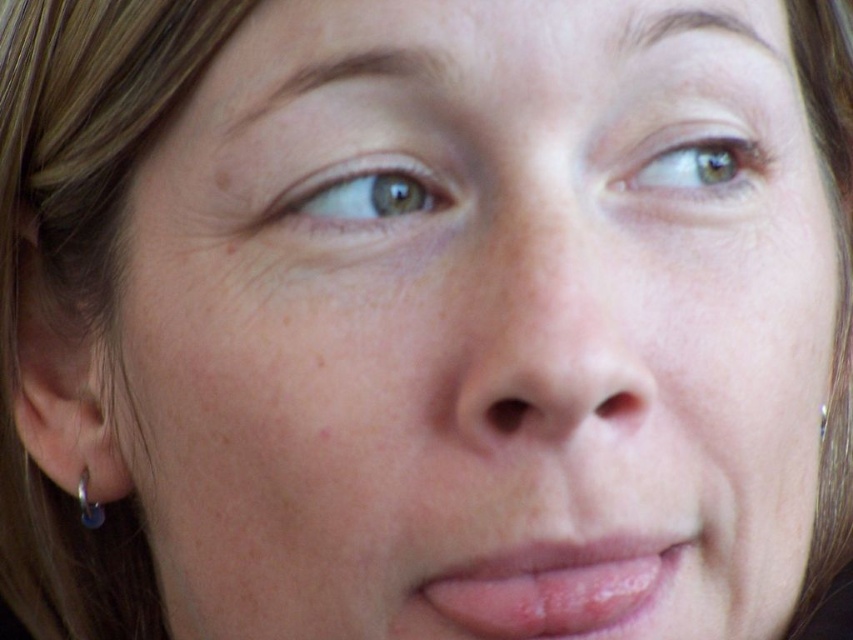
You are an artist sketching the person in the image. You want to draw the point at coordinate (554, 586). Where should you place it in relation to the pink glossy lips at center?

The point at (554, 586) is on the pink glossy lips at center, so you should place it directly on the pink glossy lips at center.

You are a photographer adjusting the focus on your camera. You want to ensure both the smooth skin nose at center and the silver metallic hoop at left ear are in focus. Given their relative sizes in the image, which object should you adjust the focus for first?

The smooth skin nose at center is taller than the silver metallic hoop at left ear, so you should focus on the smooth skin nose at center first since it is larger and requires more precise focus.

Consider the image. Based on the scene description, can you determine if the smooth skin nose at center is wider than the silver metallic hoop at left ear?

The smooth skin nose at center is wider than the silver metallic hoop at left ear according to the description.